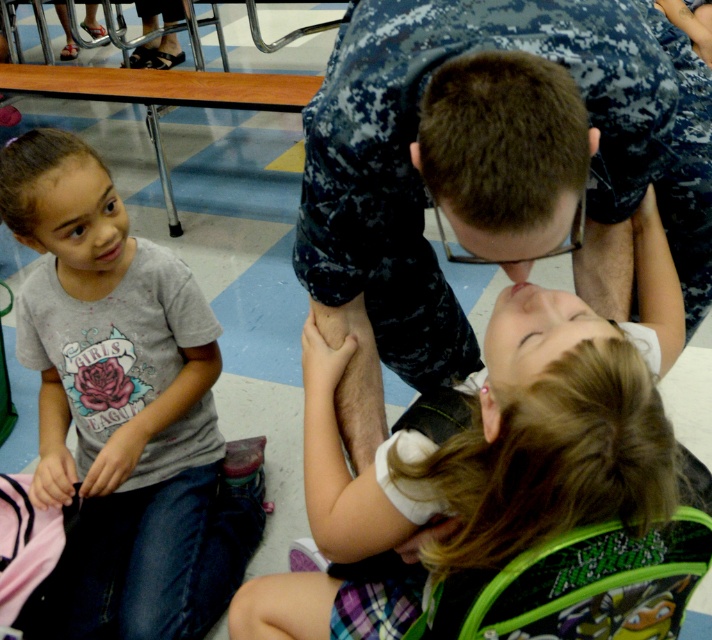
Is camouflage uniform at center above gray cotton shirt at lower left?

Yes.

The image size is (712, 640). I want to click on camouflage uniform at center, so click(x=444, y=189).